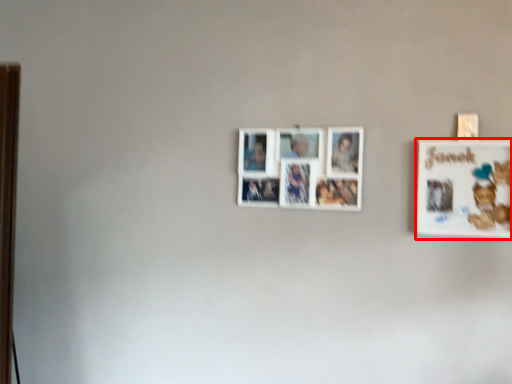
Question: Observing the image, what is the correct spatial positioning of picture frame (annotated by the red box) in reference to picture frame?

Choices:
 (A) left
 (B) right

Answer: (B)